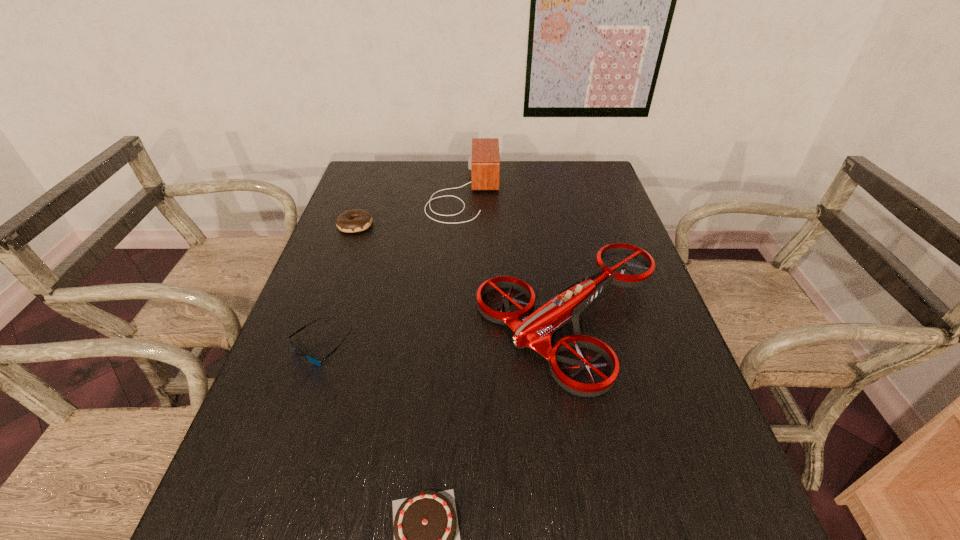
Locate an element on the screen. The height and width of the screenshot is (540, 960). radio receiver is located at coordinates (484, 162).

At what (x,y) coordinates should I click in order to perform the action: click on drone. Please return your answer as a coordinate pair (x, y). Looking at the image, I should click on (534, 330).

The height and width of the screenshot is (540, 960). I want to click on doughnut, so click(355, 220).

Where is `sunglasses`? sunglasses is located at coordinates (315, 361).

What are the coordinates of `vacant space located on the front-facing side of the radio receiver` in the screenshot? It's located at (559, 192).

Locate an element on the screen. The height and width of the screenshot is (540, 960). free space located on the back of the fourth shortest object is located at coordinates (553, 239).

This screenshot has width=960, height=540. Identify the location of blank space located on the right of the doughnut. (454, 225).

This screenshot has width=960, height=540. Find the location of `vacant space situated 0.270m at the front of the sunglasses showing the lenses`. vacant space situated 0.270m at the front of the sunglasses showing the lenses is located at coordinates (268, 501).

I want to click on object that is at the far edge, so click(x=484, y=162).

Where is `doughnut that is at the left edge`? The width and height of the screenshot is (960, 540). doughnut that is at the left edge is located at coordinates (355, 220).